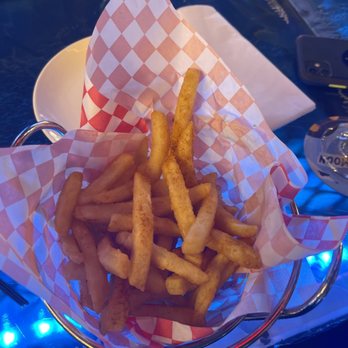
You are a GUI agent. You are given a task and a screenshot of the screen. Output one action in this format:
    pyautogui.click(x=<x>, y=<y>)
    Task: Click on the metal food basket
    This screenshot has width=348, height=348.
    Given the screenshot: What is the action you would take?
    pyautogui.click(x=66, y=323)